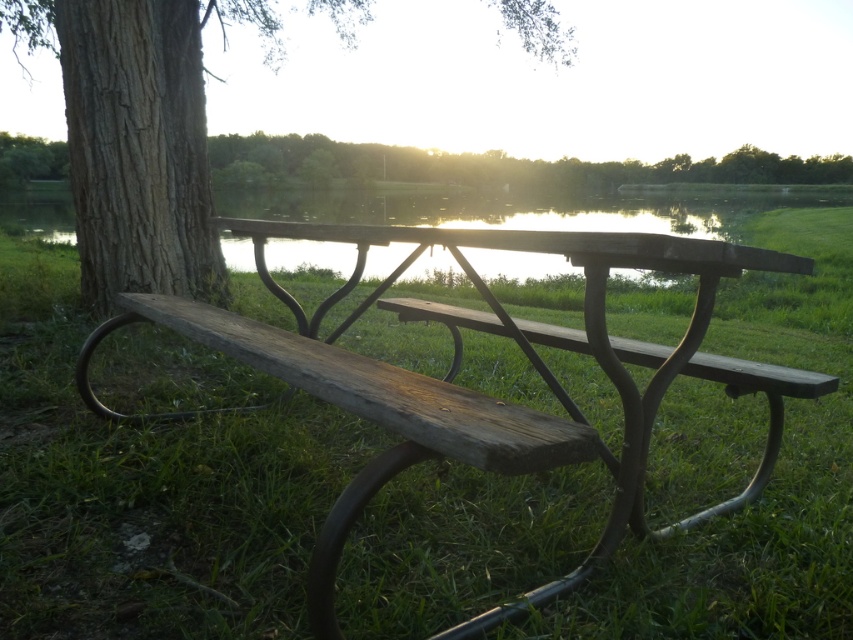
Question: Which object appears farthest from the camera in this image?

Choices:
 (A) brown rough bark tree at left
 (B) brown rough bark tree at upper left

Answer: (B)

Question: Considering the real-world distances, which object is closest to the brown rough bark tree at upper left?

Choices:
 (A) brown rough bark tree at left
 (B) weathered wood bench at center

Answer: (B)

Question: Does weathered wood bench at center appear under brown rough bark tree at upper left?

Choices:
 (A) yes
 (B) no

Answer: (A)

Question: Is brown rough bark tree at left to the right of brown rough bark tree at upper left from the viewer's perspective?

Choices:
 (A) yes
 (B) no

Answer: (B)

Question: Among these points, which one is farthest from the camera?

Choices:
 (A) (0, 184)
 (B) (117, 321)

Answer: (A)

Question: In this image, where is weathered wood bench at center located relative to brown rough bark tree at upper left?

Choices:
 (A) below
 (B) above

Answer: (A)